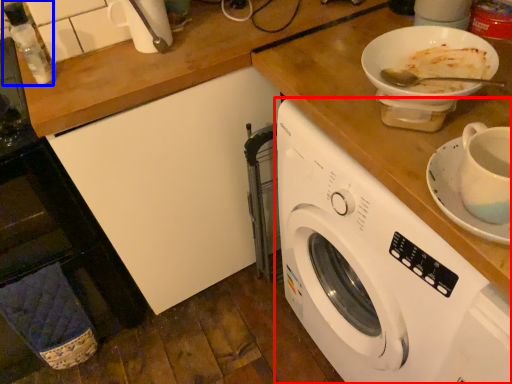
Question: Which object appears closest to the camera in this image, washing machine (highlighted by a red box) or bottle (highlighted by a blue box)?

Choices:
 (A) washing machine
 (B) bottle

Answer: (A)